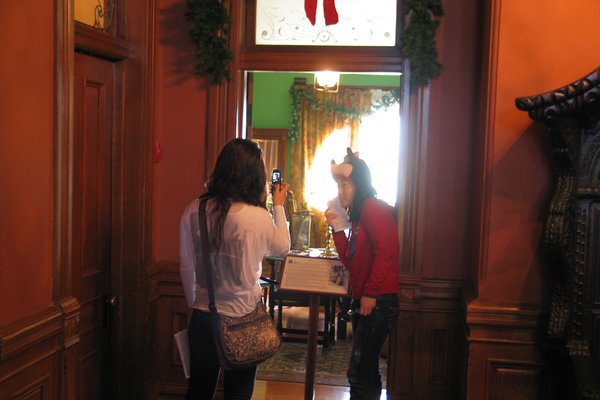
Where is `top of doorway`? The height and width of the screenshot is (400, 600). top of doorway is located at coordinates coord(329,66).